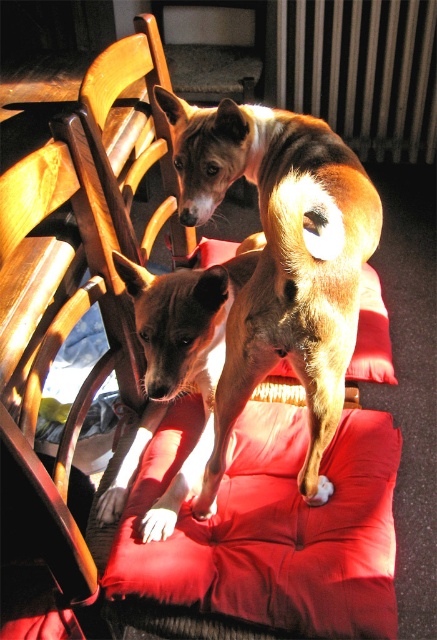
You are a dog trainer observing two dogs on a red cushioned chair. The dogs are at point (315,404). You need to ensure they have enough space to move comfortably. What is the minimum distance required between them for comfort, and does their current separation meet this requirement?

The minimum comfortable distance for dogs is typically 24 inches. The dogs are currently 39.26 inches apart, which exceeds the recommended distance, so they have sufficient space.

You are standing in front of the red cushioned chair where the brown furry dog at center is located. You want to pet the dog without getting too close. What is the minimum distance you should maintain to safely reach out?

The minimum distance you should maintain is 32.68 inches from the brown furry dog at center to safely reach out and pet it without getting too close.

You are a dog owner trying to decide where to place a new dog bed. You see the brown furry dog at center and the velvet red cushion at center in the image. Which object is on top of the other?

The brown furry dog at center is positioned over velvet red cushion at center, so the dog is on top of the cushion.